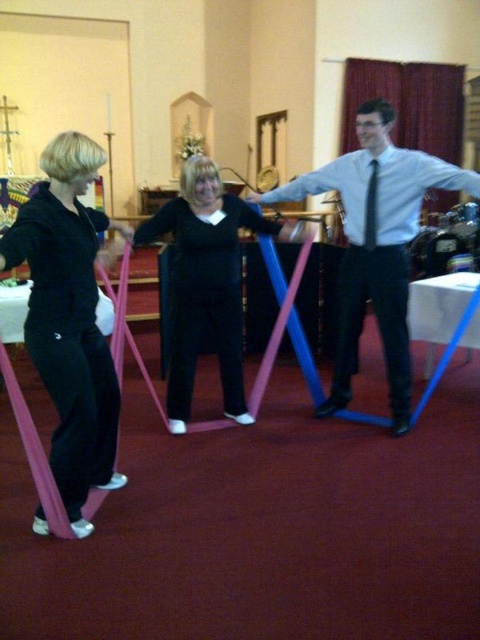
Question: Which object is farther from the camera taking this photo?

Choices:
 (A) black matte leggings at center
 (B) black satin tie at center
 (C) black matte pants at left

Answer: (B)

Question: Where is black matte pants at left located in relation to matte blue tie at center in the image?

Choices:
 (A) above
 (B) below

Answer: (B)

Question: Can you confirm if black matte pants at left is thinner than black matte leggings at center?

Choices:
 (A) no
 (B) yes

Answer: (B)

Question: Which object is closer to the camera taking this photo?

Choices:
 (A) black satin tie at center
 (B) black matte leggings at center

Answer: (B)

Question: Which point is closer to the camera?

Choices:
 (A) matte blue tie at center
 (B) black matte leggings at center

Answer: (A)

Question: Observing the image, what is the correct spatial positioning of black matte leggings at center in reference to black satin tie at center?

Choices:
 (A) left
 (B) right

Answer: (A)